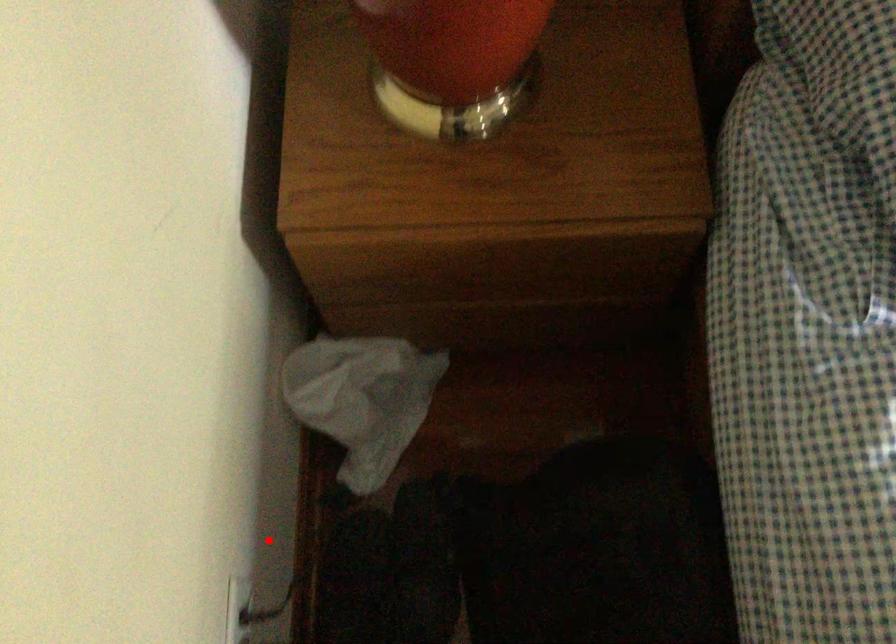
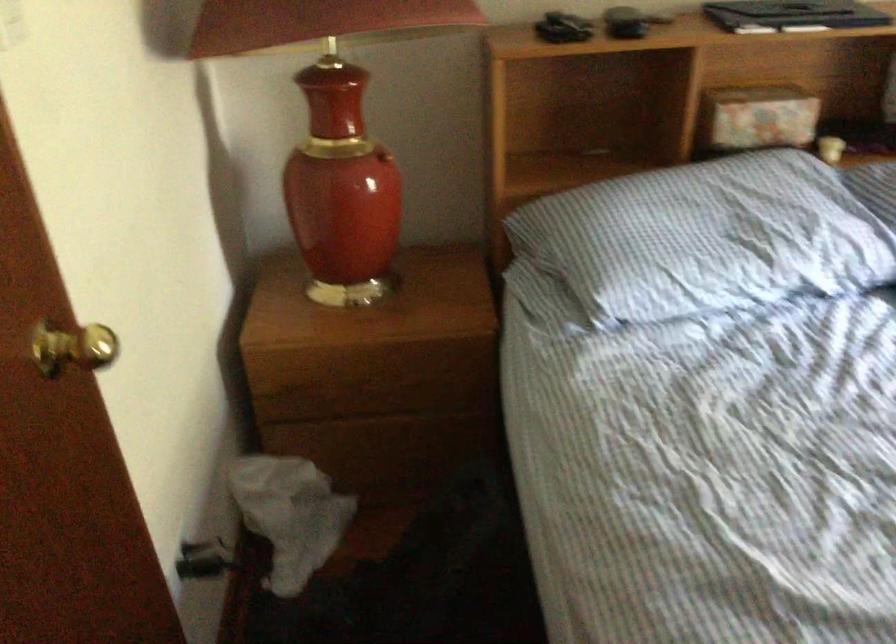
The point at the highlighted location is marked in the first image. Where is the corresponding point in the second image?

(204, 560)